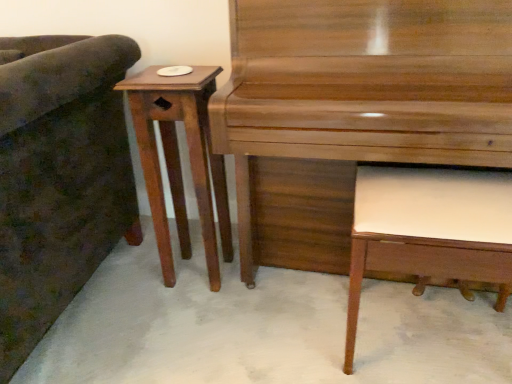
In order to click on vacant area that lies to the right of mahogany wood side table at left in this screenshot , I will do `click(262, 288)`.